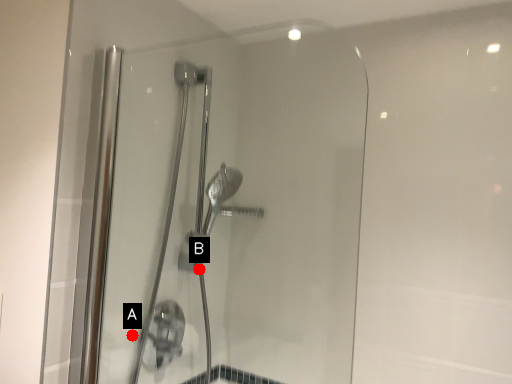
Question: Two points are circled on the image, labeled by A and B beside each circle. Which point appears closest to the camera in this image?

Choices:
 (A) A is closer
 (B) B is closer

Answer: (A)